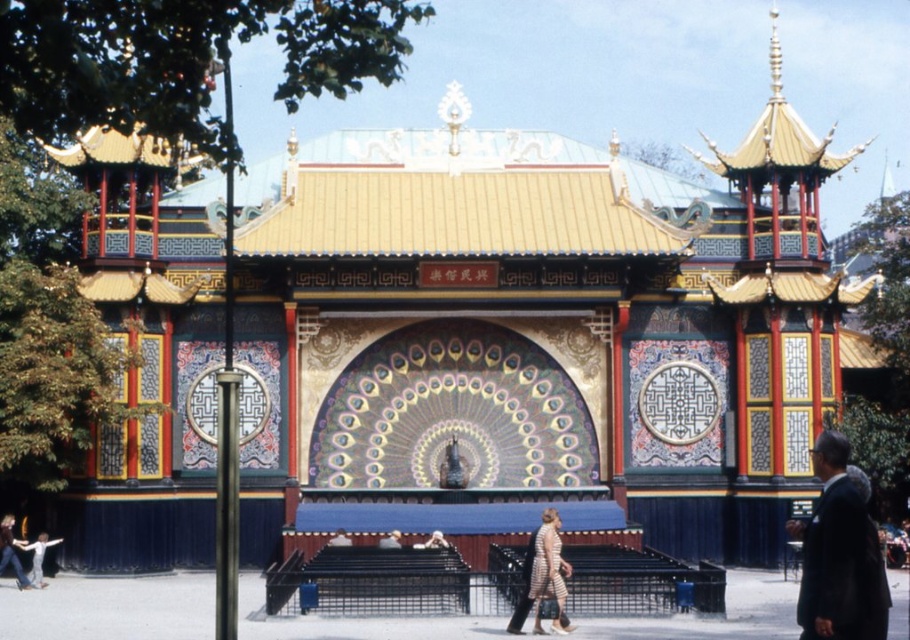
You are attending a formal event and see a dark suit at right and a striped fabric dress at center. Which clothing item is positioned more to the right side of the scene?

The dark suit at right is positioned more to the right side of the scene compared to the striped fabric dress at center.

You are standing in front of the ornate pavilion and want to determine the relative positions of two points on its roof. Which of the two points, point 1 at coordinates point [836,531] or point 2 at coordinates point [554,554], is closer to your viewpoint?

Point 1 at coordinates point [836,531] is closer to the camera than point 2 at coordinates point [554,554].